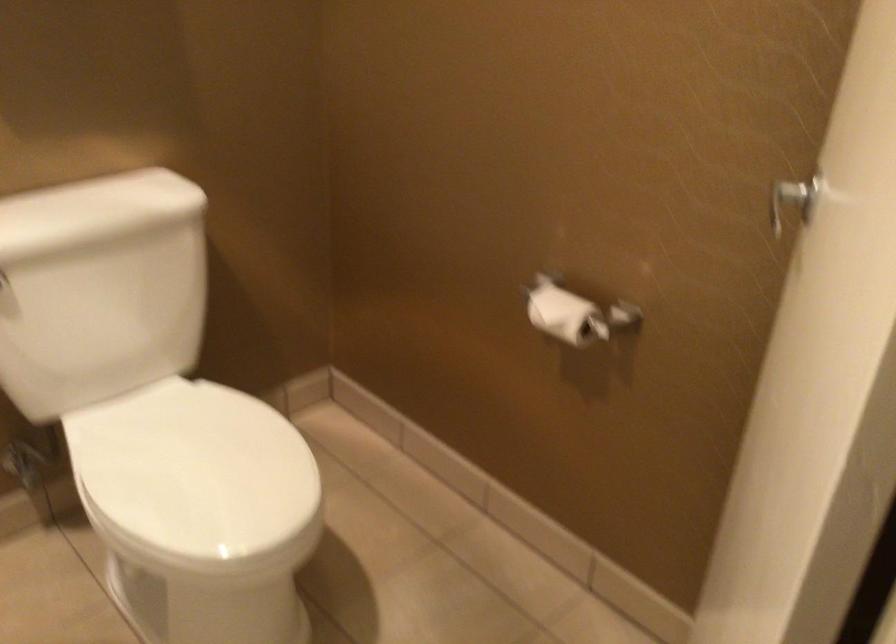
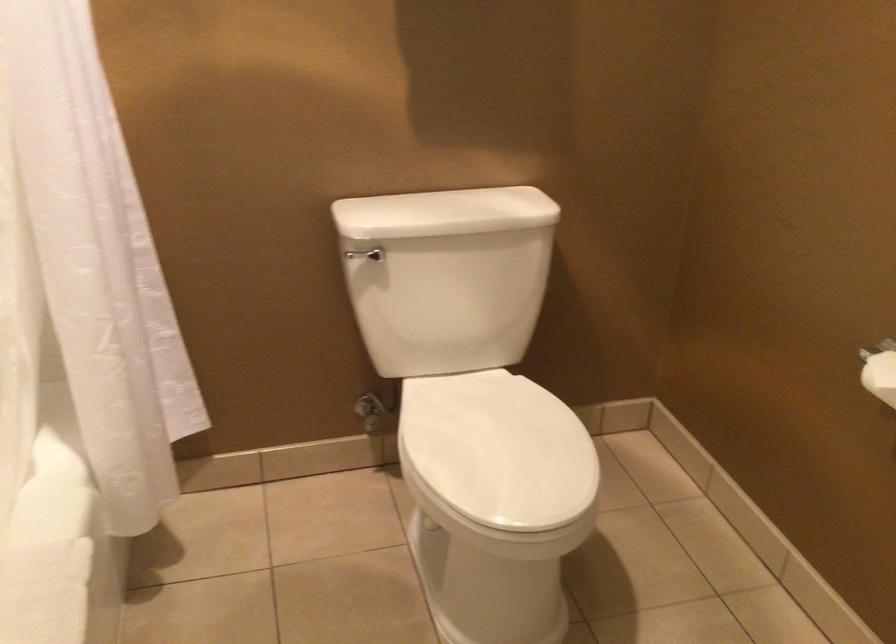
Where in the second image is the point corresponding to (207,469) from the first image?

(498, 450)